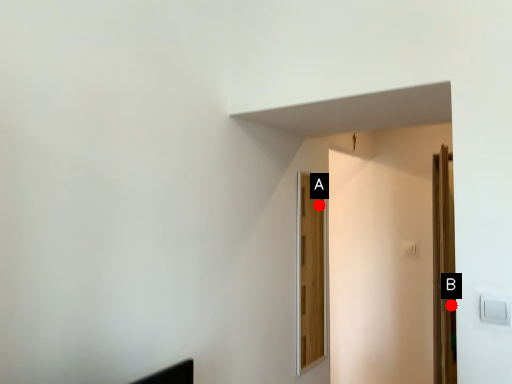
Question: Two points are circled on the image, labeled by A and B beside each circle. Which point is farther to the camera?

Choices:
 (A) A is further
 (B) B is further

Answer: (A)